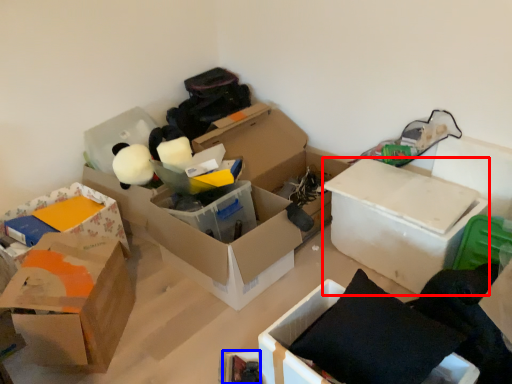
Question: Among these objects, which one is farthest to the camera, box (highlighted by a red box) or storage box (highlighted by a blue box)?

Choices:
 (A) box
 (B) storage box

Answer: (A)